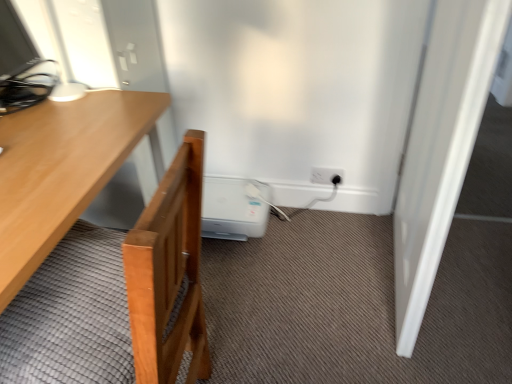
Question: Should I look upward or downward to see white smooth door at right?

Choices:
 (A) up
 (B) down

Answer: (A)

Question: Is white smooth door at right positioned in front of white plastic electric outlet at lower right?

Choices:
 (A) yes
 (B) no

Answer: (A)

Question: Does white smooth door at right have a greater height compared to white plastic electric outlet at lower right?

Choices:
 (A) yes
 (B) no

Answer: (A)

Question: Can you confirm if white smooth door at right is bigger than white plastic electric outlet at lower right?

Choices:
 (A) yes
 (B) no

Answer: (A)

Question: From the image's perspective, does white smooth door at right appear lower than white plastic electric outlet at lower right?

Choices:
 (A) no
 (B) yes

Answer: (A)

Question: Can you confirm if white smooth door at right is thinner than white plastic electric outlet at lower right?

Choices:
 (A) yes
 (B) no

Answer: (B)

Question: Can you confirm if white smooth door at right is wider than white plastic electric outlet at lower right?

Choices:
 (A) yes
 (B) no

Answer: (A)

Question: From a real-world perspective, is white smooth door at right beneath white plastic water heater at lower center?

Choices:
 (A) yes
 (B) no

Answer: (B)

Question: From the image's perspective, is white smooth door at right on top of white plastic water heater at lower center?

Choices:
 (A) yes
 (B) no

Answer: (A)

Question: Can white plastic water heater at lower center be found inside white smooth door at right?

Choices:
 (A) no
 (B) yes

Answer: (A)

Question: Is white smooth door at right wider than white plastic water heater at lower center?

Choices:
 (A) yes
 (B) no

Answer: (B)

Question: Would you consider white smooth door at right to be distant from white plastic water heater at lower center?

Choices:
 (A) no
 (B) yes

Answer: (A)

Question: From a real-world perspective, is white smooth door at right on top of white plastic water heater at lower center?

Choices:
 (A) no
 (B) yes

Answer: (B)

Question: Is white plastic water heater at lower center to the right of white smooth door at right from the viewer's perspective?

Choices:
 (A) yes
 (B) no

Answer: (B)